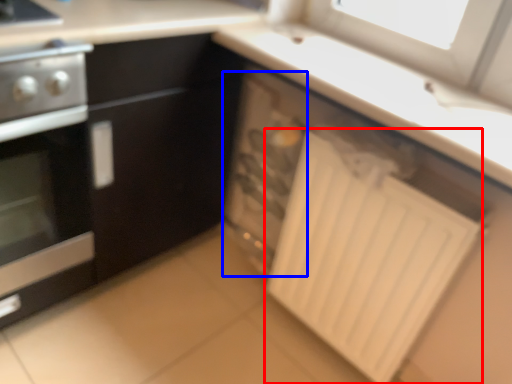
Question: Which object appears farthest to the camera in this image, radiator (highlighted by a red box) or appliance (highlighted by a blue box)?

Choices:
 (A) radiator
 (B) appliance

Answer: (B)